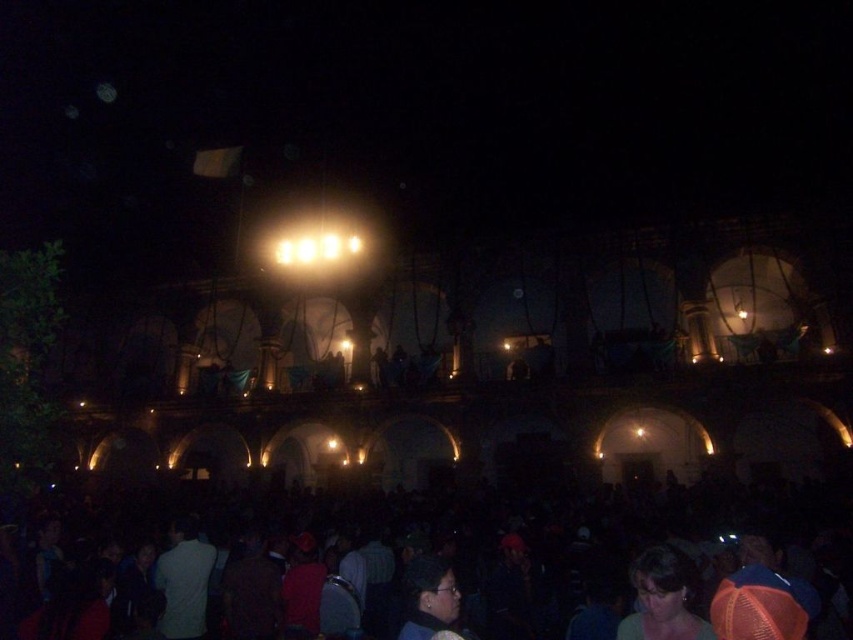
Is smooth brown hair at lower right taller than matte black hair at lower center?

In fact, smooth brown hair at lower right may be shorter than matte black hair at lower center.

Who is higher up, smooth brown hair at lower right or matte black hair at lower center?

smooth brown hair at lower right is higher up.

Find the location of a particular element. The width and height of the screenshot is (853, 640). smooth brown hair at lower right is located at coordinates (662, 598).

How far apart are dark matte crowd at lower center and smooth brown hair at lower right?

dark matte crowd at lower center is 12.08 meters away from smooth brown hair at lower right.

Who is more forward, (590,621) or (674,624)?

Positioned in front is point (674,624).

The image size is (853, 640). Find the location of `dark matte crowd at lower center`. dark matte crowd at lower center is located at coordinates (419, 554).

Does dark matte crowd at lower center have a larger size compared to matte black hair at lower center?

Correct, dark matte crowd at lower center is larger in size than matte black hair at lower center.

Between dark matte crowd at lower center and matte black hair at lower center, which one has more height?

Standing taller between the two is dark matte crowd at lower center.

What do you see at coordinates (419, 554) in the screenshot? I see `dark matte crowd at lower center` at bounding box center [419, 554].

This screenshot has width=853, height=640. What are the coordinates of `dark matte crowd at lower center` in the screenshot? It's located at (419, 554).